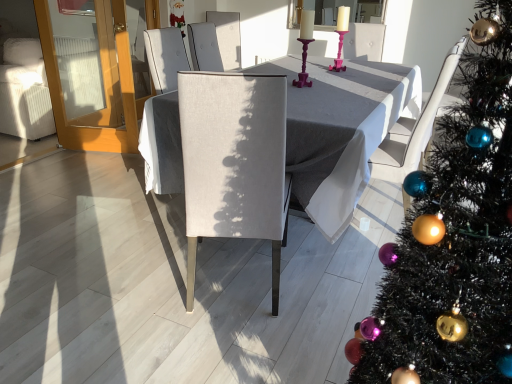
Locate an element on the screen. vacant space that's between matte gray table at center and matte gray chair at center is located at coordinates (227, 276).